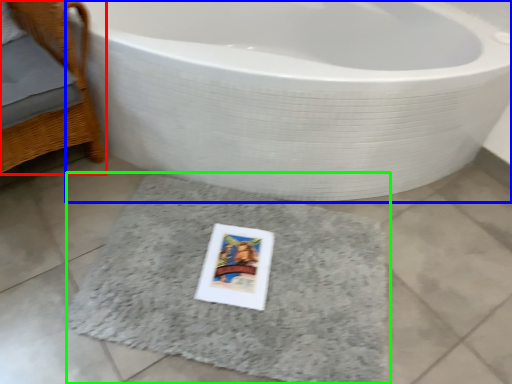
Question: Considering the real-world distances, which object is closest to furniture (highlighted by a red box)? bathtub (highlighted by a blue box) or bath mat (highlighted by a green box).

Choices:
 (A) bathtub
 (B) bath mat

Answer: (A)